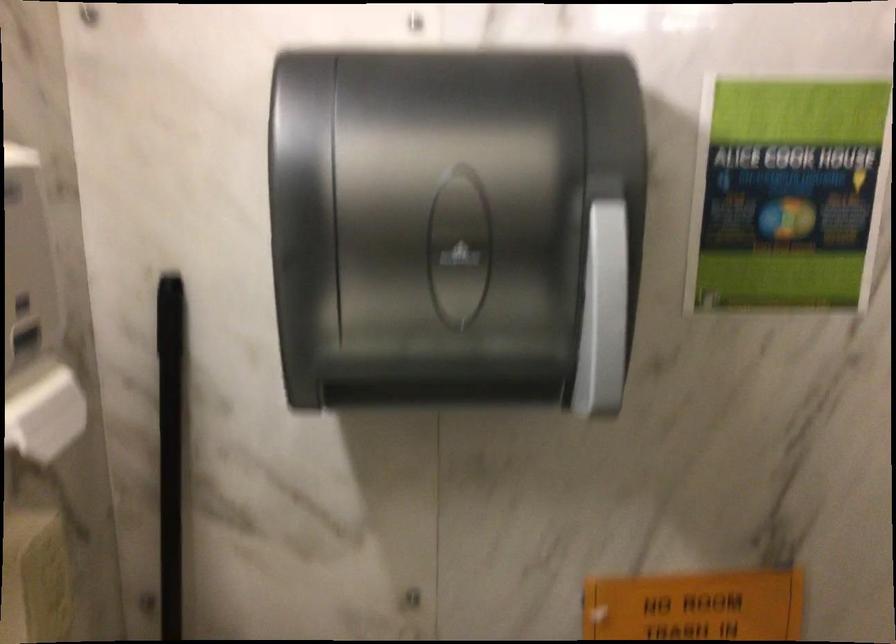
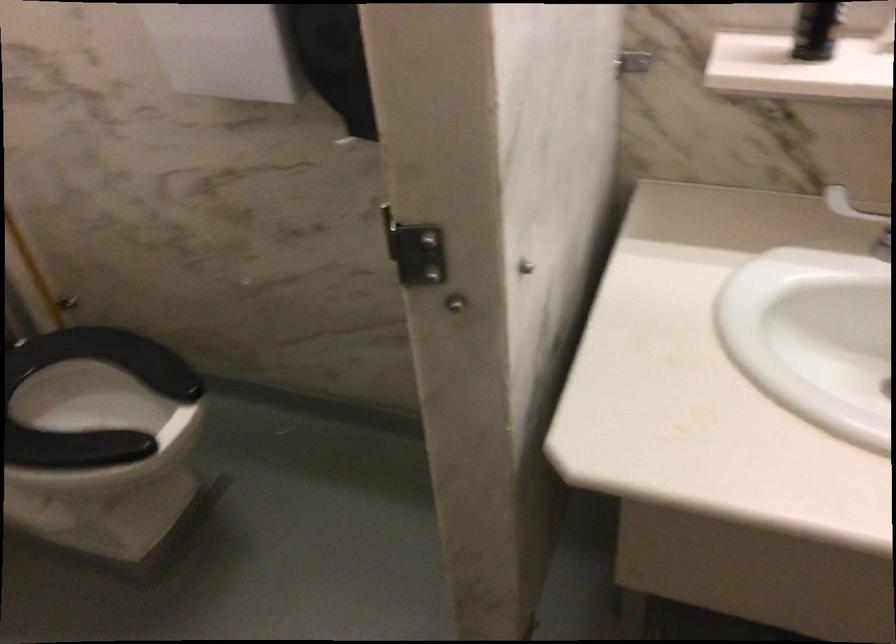
In the scene shown: The first image is from the beginning of the video and the second image is from the end. How did the camera likely rotate when shooting the video?

The camera's rotation is toward left-down.